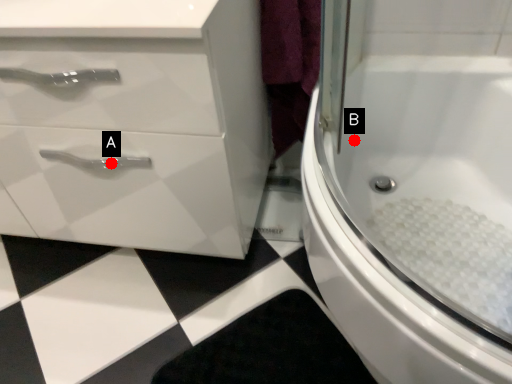
Question: Two points are circled on the image, labeled by A and B beside each circle. Which point appears farthest from the camera in this image?

Choices:
 (A) A is further
 (B) B is further

Answer: (B)